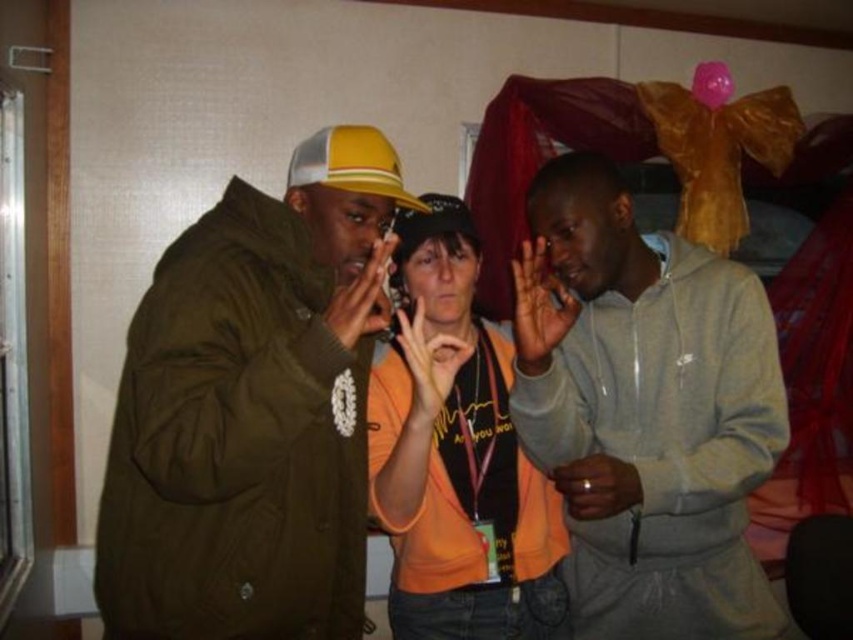
You are an observer standing in front of the three people. Which of the two yellow baseball caps, the yellow mesh baseball cap at upper left or the matte yellow baseball cap at center, is taller?

The yellow mesh baseball cap at upper left has a greater height compared to the matte yellow baseball cap at center.

You are standing in the room and want to reach the point at coordinates point (521, 248) from the point at coordinates point (403, 252). Which direction should you move in to get there?

To reach point (521, 248) from point (403, 252), you should move forward since point (521, 248) is in front of point (403, 252).